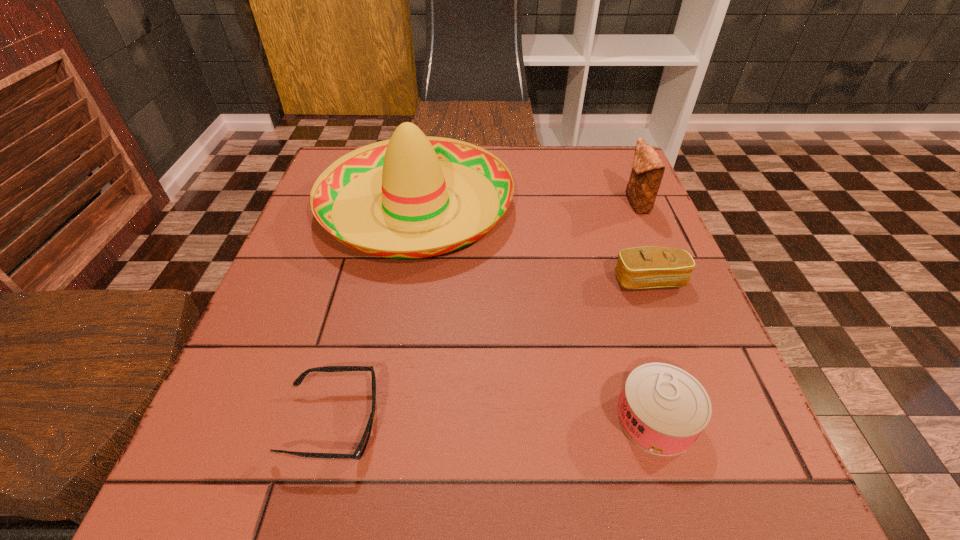
Where is `unoccupied area between the can and the nearer clutch bag`? This screenshot has width=960, height=540. unoccupied area between the can and the nearer clutch bag is located at coordinates (653, 350).

The image size is (960, 540). I want to click on empty space that is in between the tallest object and the shortest object, so click(x=374, y=314).

Identify the location of free spot between the tallest object and the shortest object. pyautogui.click(x=374, y=314).

Identify the location of vacant space that is in between the can and the shortest object. (494, 421).

Where is `free space between the sunglasses and the farther clutch bag`? Image resolution: width=960 pixels, height=540 pixels. free space between the sunglasses and the farther clutch bag is located at coordinates (485, 313).

Image resolution: width=960 pixels, height=540 pixels. Find the location of `empty location between the shortest object and the taller clutch bag`. empty location between the shortest object and the taller clutch bag is located at coordinates (485, 313).

Where is `free spot between the shorter clutch bag and the farther clutch bag`? This screenshot has width=960, height=540. free spot between the shorter clutch bag and the farther clutch bag is located at coordinates (643, 242).

Find the location of `unoccupied position between the can and the farther clutch bag`. unoccupied position between the can and the farther clutch bag is located at coordinates (646, 311).

Locate an element on the screen. free space that is in between the shorter clutch bag and the can is located at coordinates (653, 350).

This screenshot has height=540, width=960. I want to click on object that stands as the third closest to the taller clutch bag, so click(663, 409).